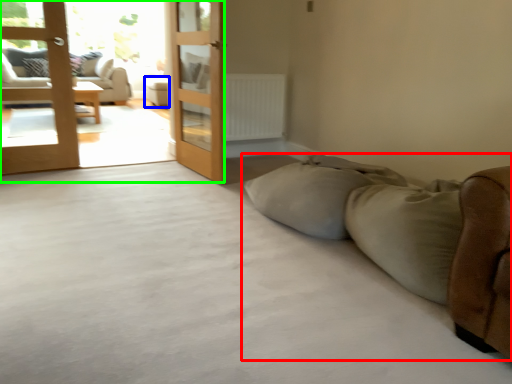
Question: Based on their relative distances, which object is farther from studio couch (highlighted by a red box)? Choose from furniture (highlighted by a blue box) and terrace (highlighted by a green box).

Choices:
 (A) furniture
 (B) terrace

Answer: (A)